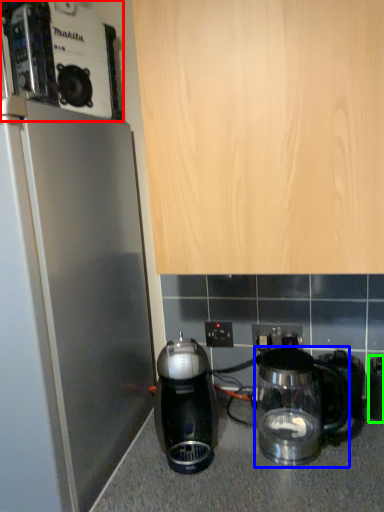
Question: Which is farther away from coffee maker (highlighted by a red box)? kitchen appliance (highlighted by a blue box) or appliance (highlighted by a green box)?

Choices:
 (A) kitchen appliance
 (B) appliance

Answer: (B)